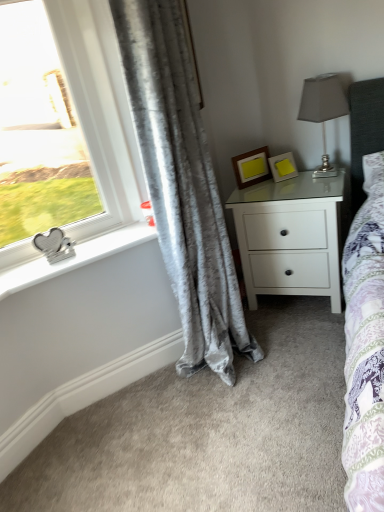
The height and width of the screenshot is (512, 384). I want to click on satin silver table lamp at upper right, so click(323, 110).

The image size is (384, 512). What do you see at coordinates (99, 109) in the screenshot? I see `white plastic window at upper left` at bounding box center [99, 109].

What do you see at coordinates (283, 167) in the screenshot? The height and width of the screenshot is (512, 384). I see `yellow matte picture frame at upper right, the second picture frame positioned from the left` at bounding box center [283, 167].

Find the location of a particular element. This screenshot has height=512, width=384. satin silver table lamp at upper right is located at coordinates (323, 110).

In terms of width, does wooden picture frame at center, which is the first picture frame from left to right, look wider or thinner when compared to white plastic window at upper left?

In the image, wooden picture frame at center, which is the first picture frame from left to right, appears to be more narrow than white plastic window at upper left.

From the image's perspective, is wooden picture frame at center, which is the first picture frame from left to right, on top of white plastic window at upper left?

Yes, from the image's perspective, wooden picture frame at center, which is the first picture frame from left to right, is on top of white plastic window at upper left.

Is wooden picture frame at center, which is the first picture frame from left to right, in contact with white plastic window at upper left?

No.

Considering the positions of objects wooden picture frame at center, which is the first picture frame from left to right, and white plastic window at upper left in the image provided, who is more to the left, wooden picture frame at center, which is the first picture frame from left to right, or white plastic window at upper left?

Positioned to the left is white plastic window at upper left.

Which object is wider, white plastic window at upper left or satin silver table lamp at upper right?

satin silver table lamp at upper right is wider.

Which is behind, point (137, 220) or point (334, 118)?

The point (334, 118) is farther.

Where is `window below the satin silver table lamp at upper right (from the image's perspective)`? This screenshot has width=384, height=512. window below the satin silver table lamp at upper right (from the image's perspective) is located at coordinates (99, 109).

Is velvet gray curtain at left far from white plastic window at upper left?

No, there isn't a large distance between velvet gray curtain at left and white plastic window at upper left.

This screenshot has height=512, width=384. In order to click on curtain in front of the white plastic window at upper left in this screenshot , I will do `click(182, 186)`.

Can you confirm if velvet gray curtain at left is bigger than white plastic window at upper left?

Yes.

How far apart are velvet gray curtain at left and white plastic window at upper left?

velvet gray curtain at left is 13.73 inches from white plastic window at upper left.

Which is behind, velvet gray curtain at left or white matte nightstand at center-right?

white matte nightstand at center-right is behind.

Between point (160, 153) and point (312, 196), which one is positioned behind?

The point (312, 196) is more distant.

Between velvet gray curtain at left and white matte nightstand at center-right, which one has larger width?

white matte nightstand at center-right is wider.

Does satin silver table lamp at upper right turn towards velvet gray curtain at left?

No, satin silver table lamp at upper right is not facing towards velvet gray curtain at left.

Which is nearer, [347,105] or [183,243]?

Clearly, point [347,105] is more distant from the camera than point [183,243].

What's the angular difference between satin silver table lamp at upper right and velvet gray curtain at left's facing directions?

The facing directions of satin silver table lamp at upper right and velvet gray curtain at left are 91.6 degrees apart.

Can you confirm if satin silver table lamp at upper right is smaller than velvet gray curtain at left?

Yes, satin silver table lamp at upper right is smaller than velvet gray curtain at left.

Could you tell me if satin silver table lamp at upper right is facing white plastic window at upper left?

No, satin silver table lamp at upper right does not turn towards white plastic window at upper left.

Is satin silver table lamp at upper right located outside white plastic window at upper left?

Absolutely, satin silver table lamp at upper right is external to white plastic window at upper left.

From the image's perspective, does satin silver table lamp at upper right appear lower than white plastic window at upper left?

Incorrect, from the image's perspective, satin silver table lamp at upper right is higher than white plastic window at upper left.

From a real-world perspective, does satin silver table lamp at upper right stand above white plastic window at upper left?

Incorrect, from a real-world perspective, satin silver table lamp at upper right is lower than white plastic window at upper left.

I want to click on picture frame below the wooden picture frame at center, which is counted as the second picture frame, starting from the right (from the image's perspective), so click(x=283, y=167).

Is point (257, 164) farther from camera compared to point (294, 162)?

No, (257, 164) is in front of (294, 162).

Between wooden picture frame at center, which is the first picture frame from left to right, and yellow matte picture frame at upper right, the second picture frame positioned from the left, which one has less height?

Standing shorter between the two is yellow matte picture frame at upper right, the second picture frame positioned from the left.

Is wooden picture frame at center, which is counted as the second picture frame, starting from the right, located outside yellow matte picture frame at upper right, the first picture frame from the right?

Yes.

From a real-world perspective, starting from the white plastic window at upper left, which picture frame is the 1st one below it? Please provide its 2D coordinates.

[(251, 167)]

Locate an element on the screen. table lamp on the right of white plastic window at upper left is located at coordinates (323, 110).

Based on their spatial positions, is white plastic window at upper left or wooden picture frame at center, which is the first picture frame from left to right, closer to satin silver table lamp at upper right?

wooden picture frame at center, which is the first picture frame from left to right, is closer to satin silver table lamp at upper right.

When comparing their distances from satin silver table lamp at upper right, does white matte nightstand at center-right or silver metallic heart-shaped object at left seem closer?

white matte nightstand at center-right is positioned closer to the anchor satin silver table lamp at upper right.

Which object lies further to the anchor point silver metallic heart-shaped object at left, satin silver table lamp at upper right or yellow matte picture frame at upper right, the first picture frame from the right?

Among the two, satin silver table lamp at upper right is located further to silver metallic heart-shaped object at left.

Which object lies further to the anchor point velvet gray curtain at left, wooden picture frame at center, which is counted as the second picture frame, starting from the right, or silver metallic heart-shaped object at left?

wooden picture frame at center, which is counted as the second picture frame, starting from the right, is further to velvet gray curtain at left.

Based on their spatial positions, is white matte nightstand at center-right or white plastic window at upper left closer to silver metallic heart-shaped object at left?

The object closer to silver metallic heart-shaped object at left is white plastic window at upper left.

Estimate the real-world distances between objects in this image. Which object is further from silver metallic heart-shaped object at left, white plastic window at upper left or satin silver table lamp at upper right?

satin silver table lamp at upper right lies further to silver metallic heart-shaped object at left than the other object.

Considering their positions, is wooden picture frame at center, which is counted as the second picture frame, starting from the right, positioned closer to velvet gray curtain at left than yellow matte picture frame at upper right, the first picture frame from the right?

wooden picture frame at center, which is counted as the second picture frame, starting from the right, lies closer to velvet gray curtain at left than the other object.

When comparing their distances from wooden picture frame at center, which is the first picture frame from left to right, does velvet gray curtain at left or white matte nightstand at center-right seem further?

Based on the image, velvet gray curtain at left appears to be further to wooden picture frame at center, which is the first picture frame from left to right.

The height and width of the screenshot is (512, 384). In order to click on nightstand between velvet gray curtain at left and yellow matte picture frame at upper right, the second picture frame positioned from the left, along the z-axis in this screenshot , I will do `click(290, 237)`.

This screenshot has height=512, width=384. I want to click on curtain located between white plastic window at upper left and satin silver table lamp at upper right in the left-right direction, so coord(182,186).

You are a GUI agent. You are given a task and a screenshot of the screen. Output one action in this format:
    pyautogui.click(x=<x>, y=<y>)
    Task: Click on the window sill between white plastic window at upper left and white matte nightstand at center-right in the horizontal direction
    The image size is (384, 512).
    Given the screenshot: What is the action you would take?
    pyautogui.click(x=74, y=258)

At what (x,y) coordinates should I click in order to perform the action: click on window sill situated between white plastic window at upper left and velvet gray curtain at left from left to right. Please return your answer as a coordinate pair (x, y). The image size is (384, 512). Looking at the image, I should click on (74, 258).